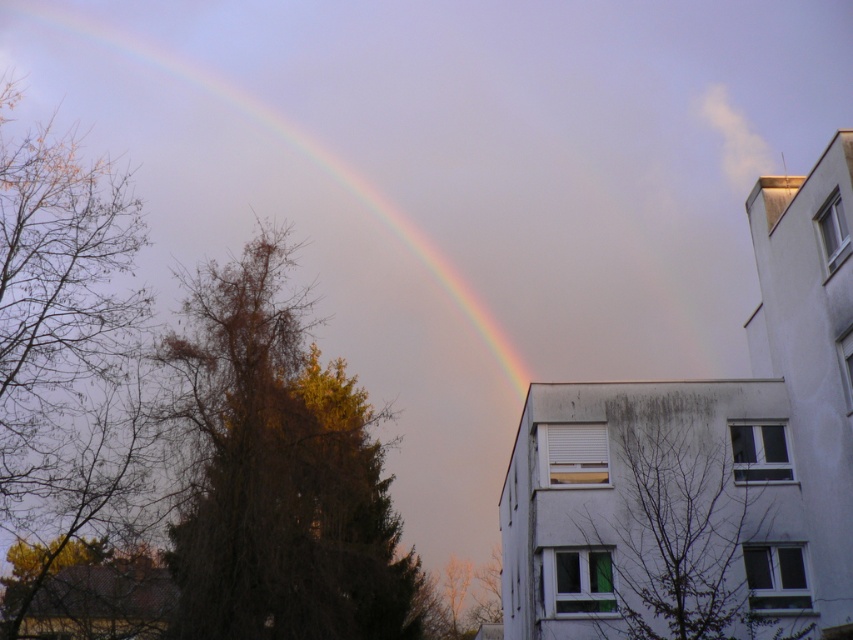
Question: Is rainbow at upper left wider than brown leafless tree at center-right?

Choices:
 (A) yes
 (B) no

Answer: (A)

Question: In this image, where is rainbow at upper left located relative to brown leafy tree at left?

Choices:
 (A) above
 (B) below

Answer: (A)

Question: Among these objects, which one is farthest from the camera?

Choices:
 (A) brown leafy tree at left
 (B) rainbow at upper left
 (C) brown/drytree at center
 (D) brown leafless tree at center-right

Answer: (B)

Question: Is brown/drytree at center above brown leafless tree at center-right?

Choices:
 (A) no
 (B) yes

Answer: (A)

Question: Among these objects, which one is nearest to the camera?

Choices:
 (A) brown/drytree at center
 (B) rainbow at upper left

Answer: (A)

Question: Which object appears closest to the camera in this image?

Choices:
 (A) brown/drytree at center
 (B) rainbow at upper left
 (C) brown leafless tree at center-right
 (D) brown leafy tree at left

Answer: (C)